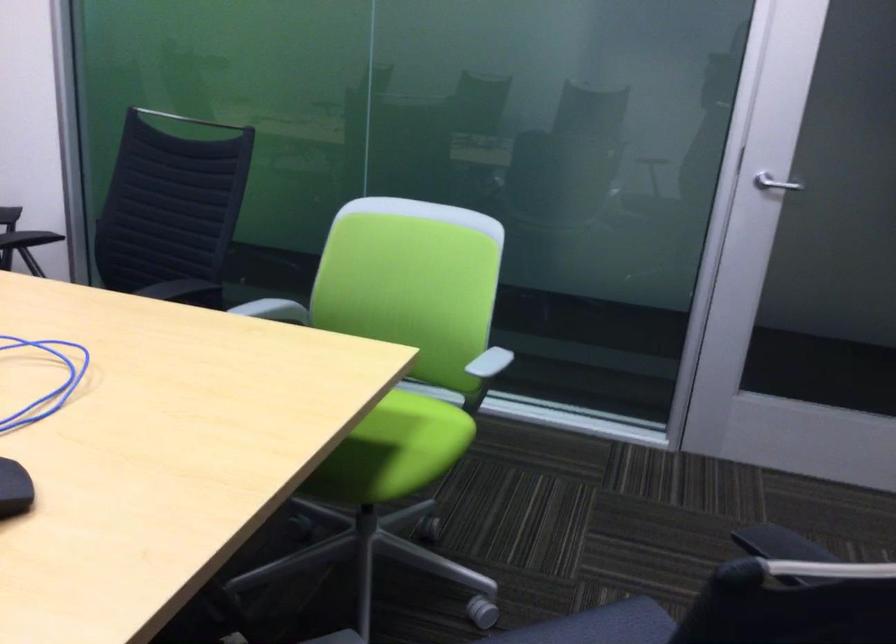
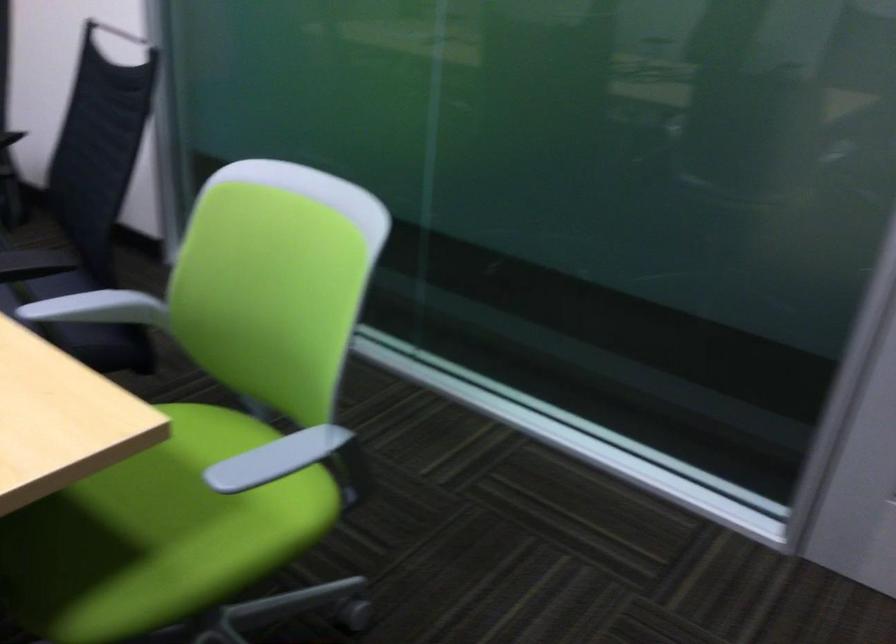
The point at (271,310) is marked in the first image. Where is the corresponding point in the second image?

(97, 308)